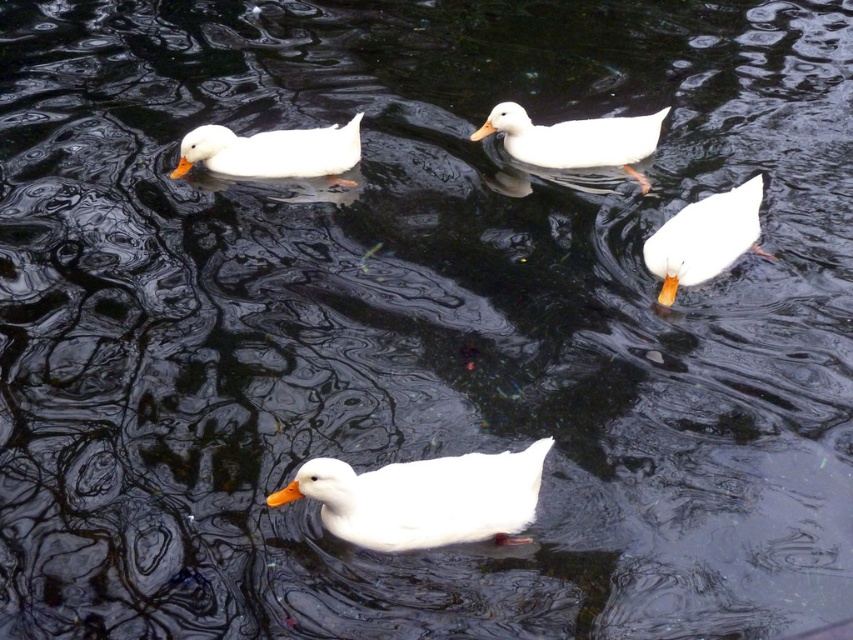
Does white matte duck at center have a lesser width compared to white matte duck at upper center?

Yes.

Does white matte duck at center have a greater height compared to white matte duck at upper center?

No, white matte duck at center is not taller than white matte duck at upper center.

Is point (352, 500) behind point (537, 136)?

That is False.

You are a GUI agent. You are given a task and a screenshot of the screen. Output one action in this format:
    pyautogui.click(x=<x>, y=<y>)
    Task: Click on the white matte duck at center
    The width and height of the screenshot is (853, 640).
    Given the screenshot: What is the action you would take?
    pyautogui.click(x=424, y=499)

Locate an element on the screen. The image size is (853, 640). white matte duck at center is located at coordinates (424, 499).

Does white matte duck at center have a lesser width compared to white matte duck at upper left?

Correct, white matte duck at center's width is less than white matte duck at upper left's.

Who is more distant from viewer, [503,516] or [204,141]?

The point [204,141] is more distant.

You are a GUI agent. You are given a task and a screenshot of the screen. Output one action in this format:
    pyautogui.click(x=<x>, y=<y>)
    Task: Click on the white matte duck at center
    The width and height of the screenshot is (853, 640).
    Given the screenshot: What is the action you would take?
    pyautogui.click(x=424, y=499)

Is point (279, 161) positioned after point (583, 132)?

No, (279, 161) is closer to viewer.

Who is lower down, white matte duck at upper left or white matte duck at upper center?

Positioned lower is white matte duck at upper left.

The width and height of the screenshot is (853, 640). Describe the element at coordinates (273, 150) in the screenshot. I see `white matte duck at upper left` at that location.

The width and height of the screenshot is (853, 640). In order to click on white matte duck at upper left in this screenshot , I will do `click(273, 150)`.